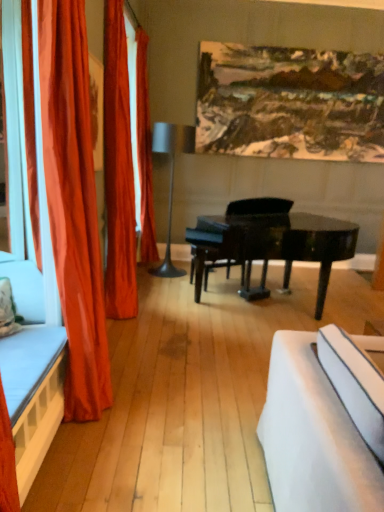
Question: Is metallic gray floor lamp at center not close to velvet orange curtain at left, which appears as the 2th curtain when viewed from the back?

Choices:
 (A) yes
 (B) no

Answer: (A)

Question: Is metallic gray floor lamp at center smaller than velvet orange curtain at left, which appears as the 2th curtain when viewed from the back?

Choices:
 (A) yes
 (B) no

Answer: (B)

Question: From a real-world perspective, is metallic gray floor lamp at center on top of velvet orange curtain at left, which ranks as the second curtain in front-to-back order?

Choices:
 (A) yes
 (B) no

Answer: (B)

Question: Is metallic gray floor lamp at center closer to the viewer compared to velvet orange curtain at left, which ranks as the second curtain in front-to-back order?

Choices:
 (A) yes
 (B) no

Answer: (B)

Question: Does metallic gray floor lamp at center appear on the left side of velvet orange curtain at left, which appears as the 2th curtain when viewed from the back?

Choices:
 (A) yes
 (B) no

Answer: (B)

Question: Is metallic gray floor lamp at center spatially inside satin orange curtain at left, which is the third curtain from back to front, or outside of it?

Choices:
 (A) inside
 (B) outside

Answer: (B)

Question: Looking at their shapes, would you say metallic gray floor lamp at center is wider or thinner than satin orange curtain at left, which ranks as the 1th curtain in front-to-back order?

Choices:
 (A) wide
 (B) thin

Answer: (A)

Question: Is point (162, 150) closer or farther from the camera than point (66, 327)?

Choices:
 (A) farther
 (B) closer

Answer: (A)

Question: In terms of height, does metallic gray floor lamp at center look taller or shorter compared to satin orange curtain at left, which ranks as the 1th curtain in front-to-back order?

Choices:
 (A) short
 (B) tall

Answer: (A)

Question: Is orange fabric curtain at left, the 3th curtain in the front-to-back sequence, spatially inside black glossy piano at center, or outside of it?

Choices:
 (A) inside
 (B) outside

Answer: (B)

Question: From a real-world perspective, is orange fabric curtain at left, the 3th curtain in the front-to-back sequence, positioned above or below black glossy piano at center?

Choices:
 (A) above
 (B) below

Answer: (A)

Question: Is orange fabric curtain at left, the 3th curtain in the front-to-back sequence, to the left or to the right of black glossy piano at center in the image?

Choices:
 (A) left
 (B) right

Answer: (A)

Question: Based on their sizes in the image, would you say orange fabric curtain at left, the 3th curtain in the front-to-back sequence, is bigger or smaller than black glossy piano at center?

Choices:
 (A) big
 (B) small

Answer: (B)

Question: From a real-world perspective, is wooden bed frame at left physically located above or below orange fabric curtain at left, the 3th curtain in the front-to-back sequence?

Choices:
 (A) below
 (B) above

Answer: (A)

Question: Relative to orange fabric curtain at left, positioned as the 1th curtain in back-to-front order, is wooden bed frame at left in front or behind?

Choices:
 (A) front
 (B) behind

Answer: (A)